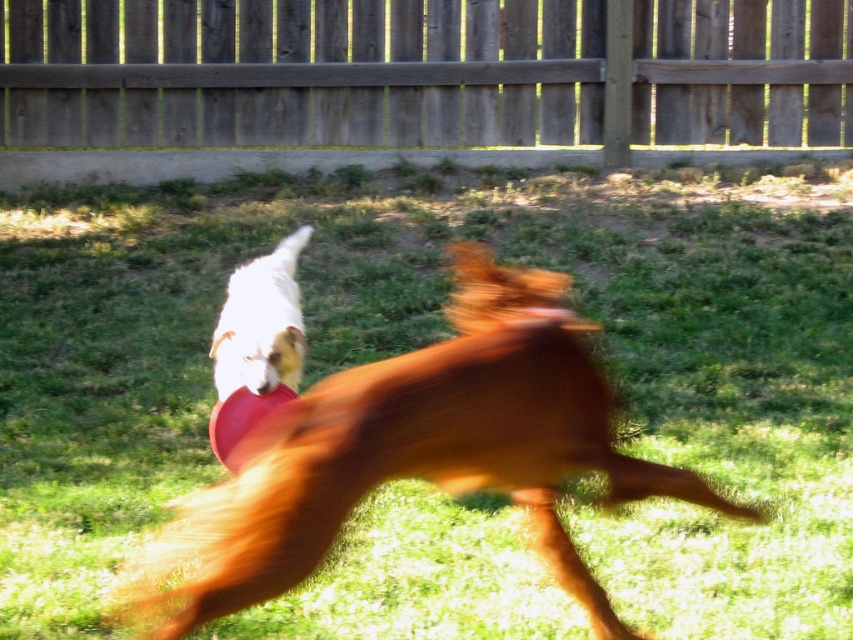
Does point (422, 410) come in front of point (248, 291)?

That is True.

The height and width of the screenshot is (640, 853). What are the coordinates of `smooth brown dog at center` in the screenshot? It's located at click(412, 454).

Does wooden fence at upper center have a greater height compared to white fur dog at upper left?

Yes, wooden fence at upper center is taller than white fur dog at upper left.

Is point (457, 8) farther from camera compared to point (257, 305)?

Yes, it is.

This screenshot has height=640, width=853. What are the coordinates of `wooden fence at upper center` in the screenshot? It's located at (421, 72).

Is point (373, 22) positioned after point (141, 547)?

Yes, it is.

Does wooden fence at upper center have a lesser height compared to smooth brown dog at center?

Indeed, wooden fence at upper center has a lesser height compared to smooth brown dog at center.

Describe the element at coordinates (421, 72) in the screenshot. The height and width of the screenshot is (640, 853). I see `wooden fence at upper center` at that location.

Image resolution: width=853 pixels, height=640 pixels. Identify the location of wooden fence at upper center. (421, 72).